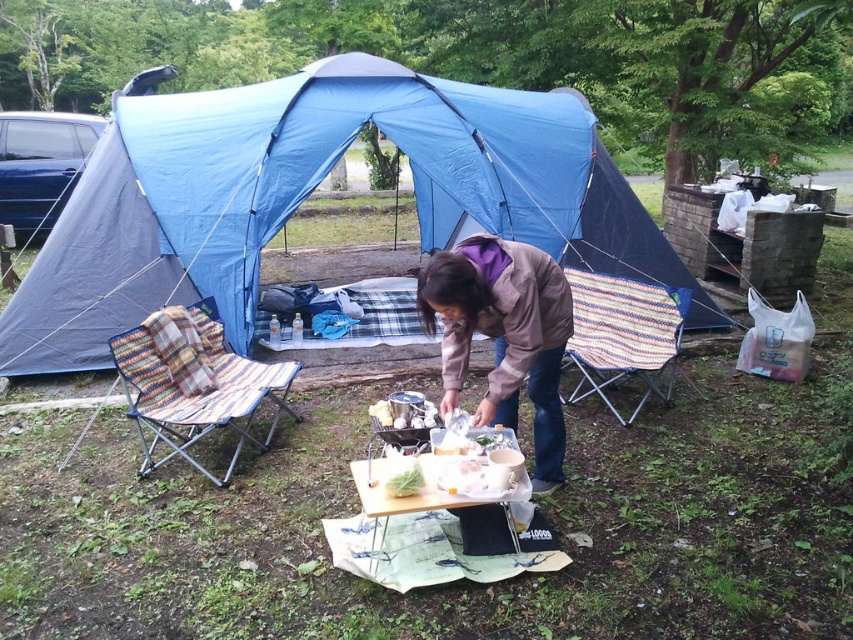
Question: Does blue fabric canopy at center appear on the left side of green leafy vegetable at center?

Choices:
 (A) yes
 (B) no

Answer: (A)

Question: Which point is farther from the camera taking this photo?

Choices:
 (A) (601, 289)
 (B) (497, 282)
 (C) (126, 84)

Answer: (C)

Question: Is blue fabric canopy at center closer to camera compared to wooden picnic table at center?

Choices:
 (A) yes
 (B) no

Answer: (B)

Question: Considering the real-world distances, which object is closest to the woven fabric chair at center?

Choices:
 (A) wooden picnic table at center
 (B) green leafy vegetable at center

Answer: (A)

Question: Which point is closer to the camera?

Choices:
 (A) multicolored woven fabric chair at left
 (B) brown fabric jacket at center
 (C) wooden picnic table at center
 (D) green leafy vegetable at center

Answer: (C)

Question: Does blue fabric canopy at center appear on the left side of woven fabric chair at center?

Choices:
 (A) yes
 (B) no

Answer: (A)